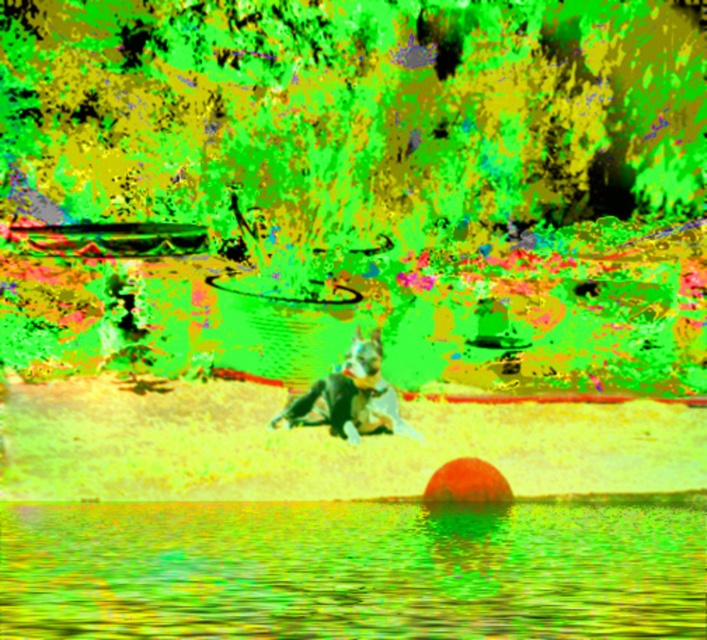
Which is more to the right, smooth water at lower center or black matte dog at center?

Positioned to the right is black matte dog at center.

Image resolution: width=707 pixels, height=640 pixels. In order to click on smooth water at lower center in this screenshot , I will do `click(354, 570)`.

Find the location of a particular element. smooth water at lower center is located at coordinates (354, 570).